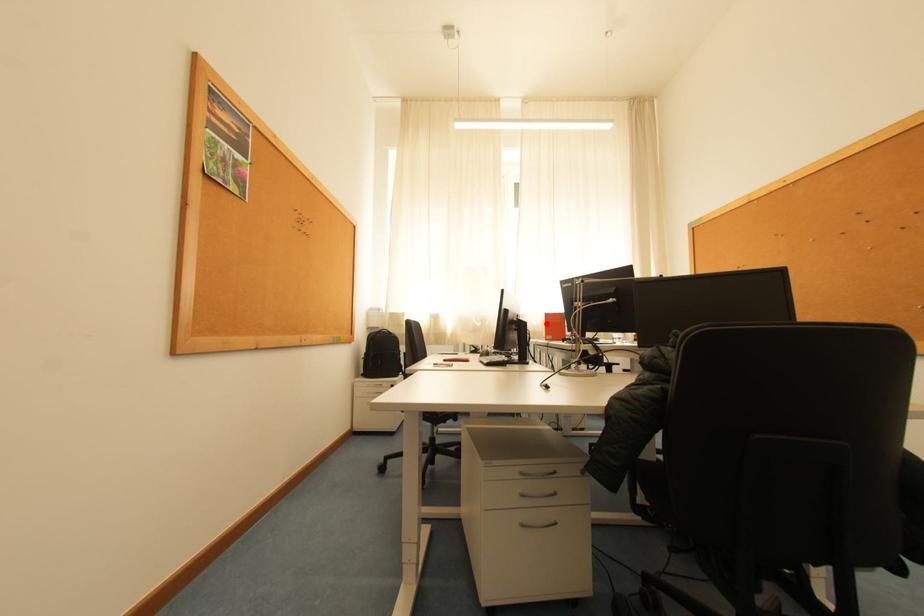
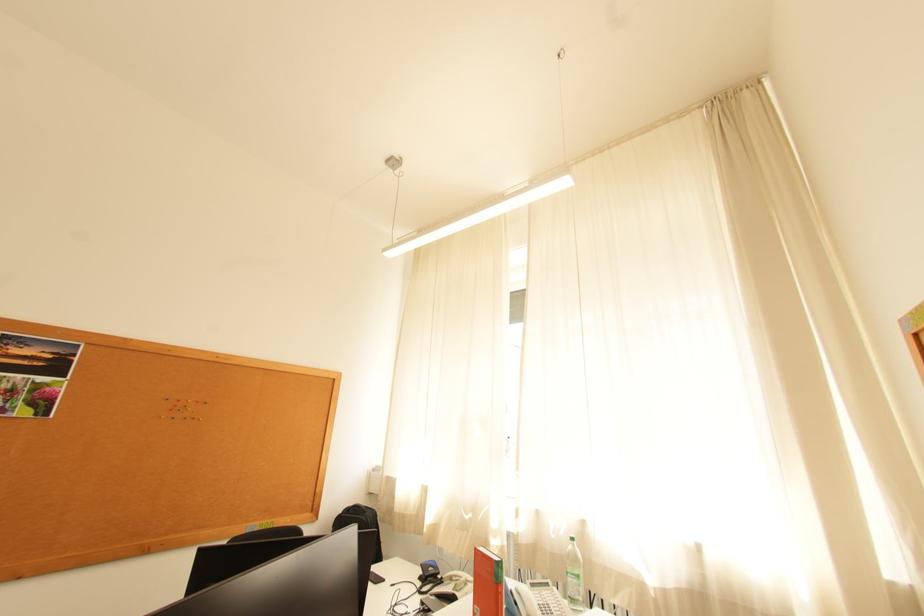
The point at the highlighted location is marked in the first image. Where is the corresponding point in the second image?

(569, 536)